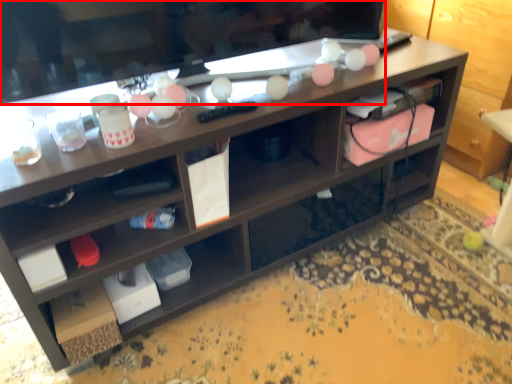
Question: From the image's perspective, what is the correct spatial relationship of television (annotated by the red box) in relation to cabinet?

Choices:
 (A) above
 (B) below

Answer: (A)